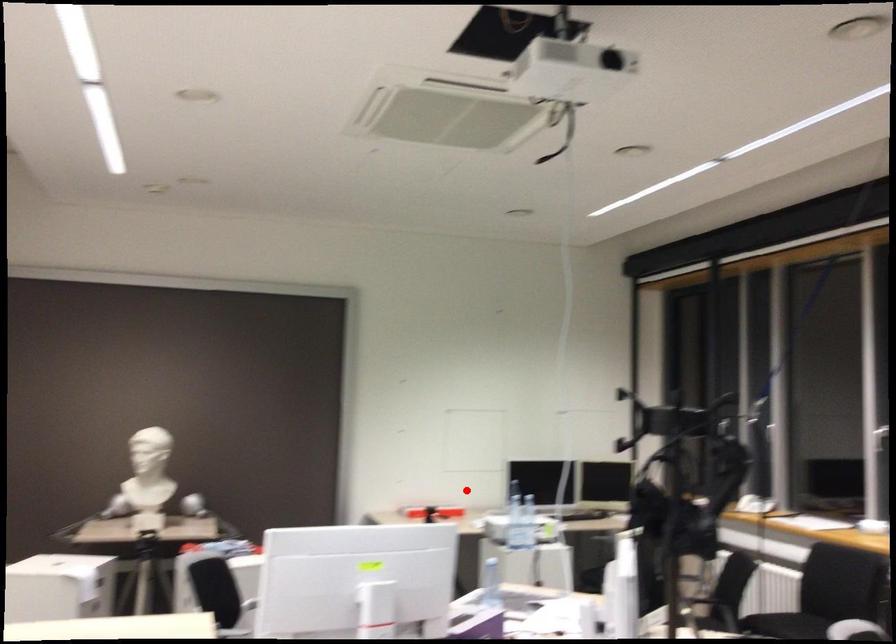
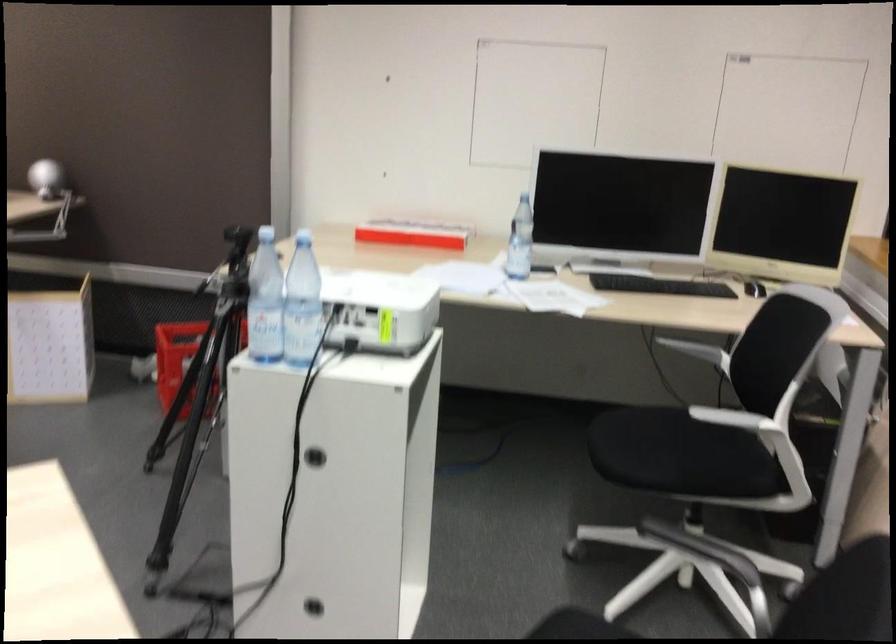
Question: I am providing you with two images of the same scene from different viewpoints. Image1 has a red point marked. In image2, the corresponding 3D location appears at what relative position? Reply with the corresponding letter.

Choices:
 (A) Closer
 (B) Farther

Answer: (A)